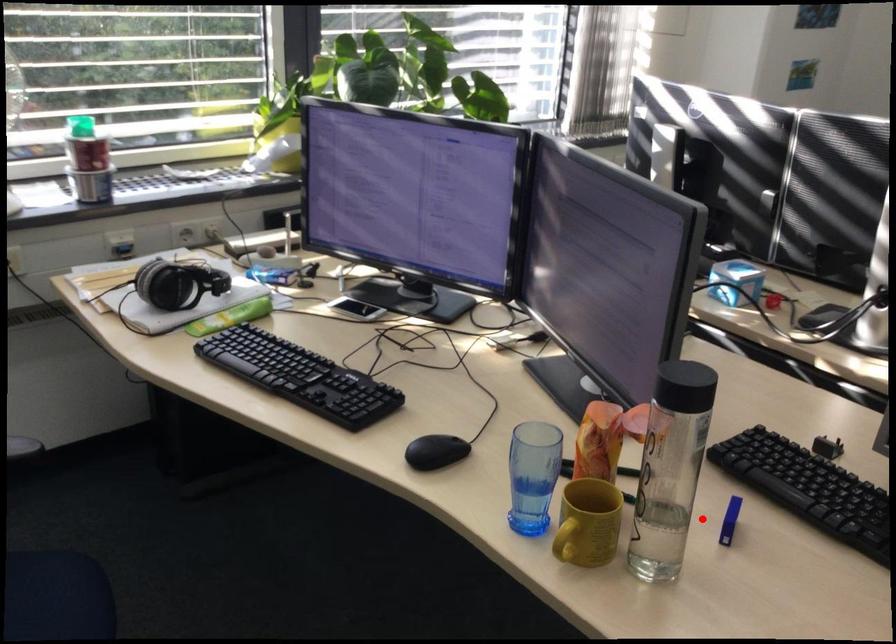
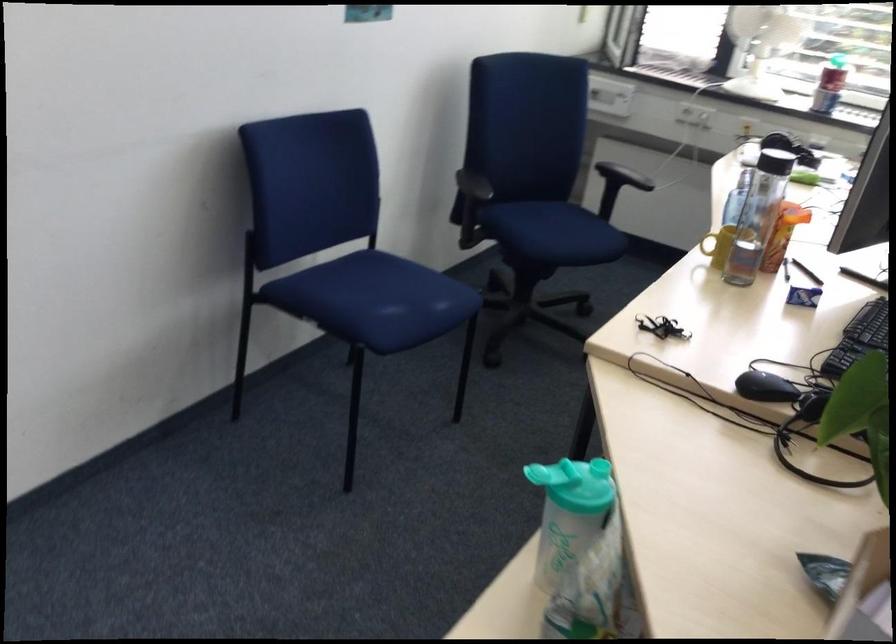
Locate, in the second image, the point that corresponds to the highlighted location in the first image.

(803, 297)